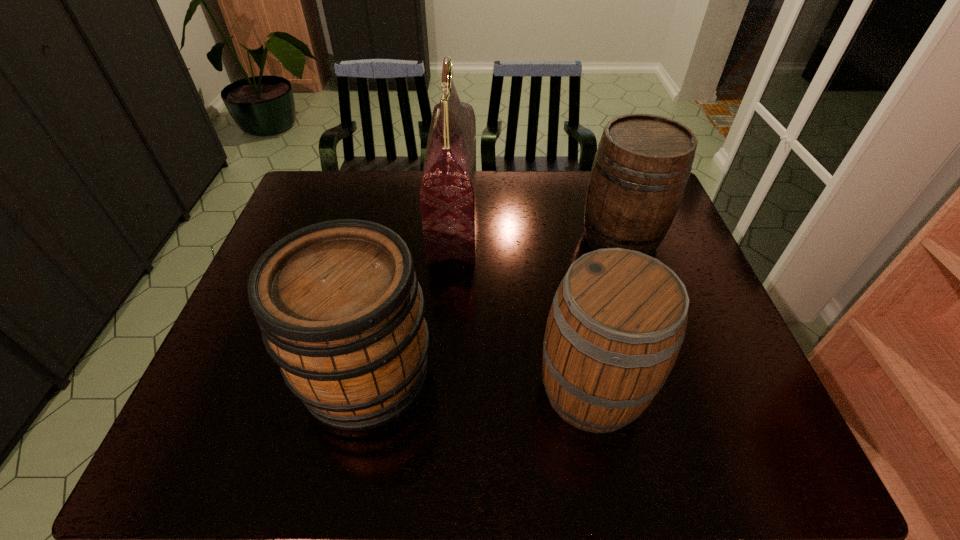
Locate an element on the screen. the tallest object is located at coordinates (448, 187).

I want to click on the farthest cider, so click(x=643, y=162).

Where is `the leftmost cider`? This screenshot has height=540, width=960. the leftmost cider is located at coordinates (340, 309).

Find the location of `vacant space located 0.150m on the front-facing side of the handbag`. vacant space located 0.150m on the front-facing side of the handbag is located at coordinates (524, 218).

The width and height of the screenshot is (960, 540). What are the coordinates of `free space located on the side of the farthest cider near the bung hole` in the screenshot? It's located at (484, 238).

The image size is (960, 540). In order to click on vacant space situated on the side of the farthest cider near the bung hole in this screenshot , I will do `click(558, 238)`.

Find the location of a particular element. This screenshot has height=540, width=960. free space located on the side of the farthest cider near the bung hole is located at coordinates (541, 238).

You are a GUI agent. You are given a task and a screenshot of the screen. Output one action in this format:
    pyautogui.click(x=<x>, y=<y>)
    Task: Click on the free space located 0.160m on the left of the leftmost cider
    The image size is (960, 540).
    Given the screenshot: What is the action you would take?
    pyautogui.click(x=228, y=373)

The width and height of the screenshot is (960, 540). I want to click on handbag that is positioned at the far edge, so click(x=448, y=187).

Find the location of a particular element. cider that is at the far edge is located at coordinates (643, 162).